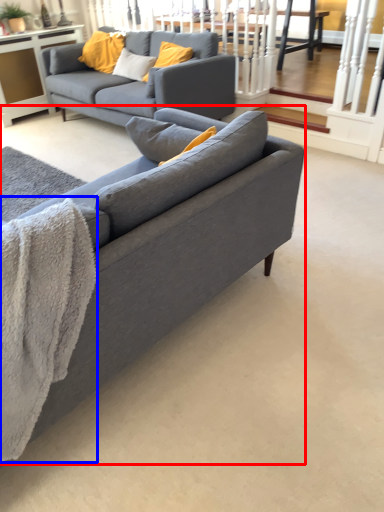
Question: Among these objects, which one is nearest to the camera, studio couch (highlighted by a red box) or blanket (highlighted by a blue box)?

Choices:
 (A) studio couch
 (B) blanket

Answer: (A)